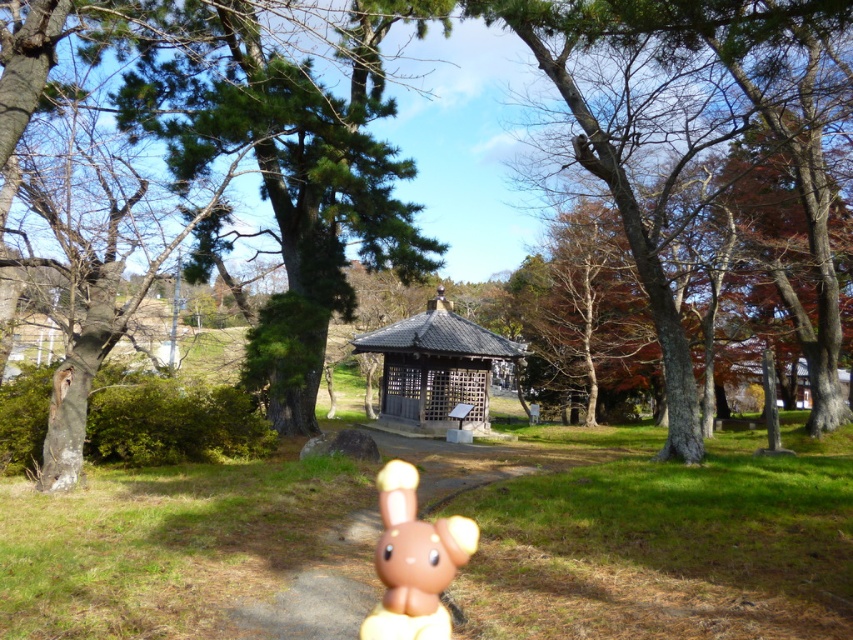
Is brown wood tree at center behind brown matte plush toy at center?

Yes, it is.

Is brown wood tree at center closer to the viewer compared to brown matte plush toy at center?

No, it is behind brown matte plush toy at center.

Does point (633, 72) lie in front of point (376, 556)?

No.

You are a GUI agent. You are given a task and a screenshot of the screen. Output one action in this format:
    pyautogui.click(x=<x>, y=<y>)
    Task: Click on the brown wood tree at center
    Image resolution: width=853 pixels, height=640 pixels.
    Given the screenshot: What is the action you would take?
    (x=706, y=145)

Is point (675, 170) positioned before point (424, 428)?

That is True.

Is brown wood tree at center behind wooden lattice gazebo at center?

No, brown wood tree at center is in front of wooden lattice gazebo at center.

What are the coordinates of `brown wood tree at center` in the screenshot? It's located at (706, 145).

I want to click on brown wood tree at center, so click(x=706, y=145).

Which is above, wooden lattice gazebo at center or brown matte plush toy at center?

wooden lattice gazebo at center

You are a GUI agent. You are given a task and a screenshot of the screen. Output one action in this format:
    pyautogui.click(x=<x>, y=<y>)
    Task: Click on the wooden lattice gazebo at center
    The image size is (853, 640).
    Given the screenshot: What is the action you would take?
    pyautogui.click(x=434, y=371)